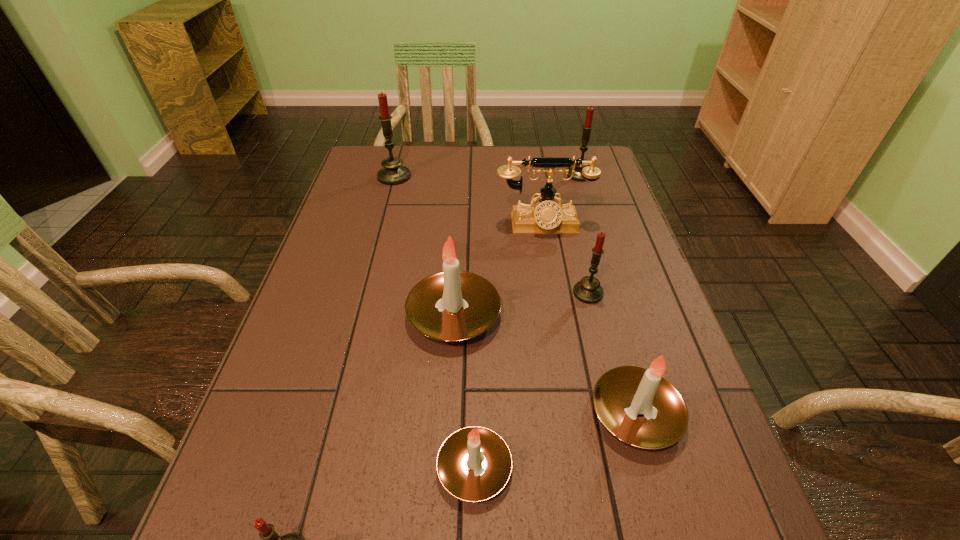
Find the location of a particular element. free space between the biggest red candle and the third smallest red candle is located at coordinates (487, 176).

Find the location of a particular element. Image resolution: width=960 pixels, height=540 pixels. vacant space that's between the third farthest red candle and the rightmost white candle is located at coordinates (612, 353).

Locate which object is the seventh closest to the second biggest red candle. Please provide its 2D coordinates. Your answer should be formatted as a tuple, i.e. [(x, y)], where the tuple contains the x and y coordinates of a point satisfying the conditions above.

[(270, 537)]

This screenshot has height=540, width=960. I want to click on object identified as the seventh closest to the tallest candle, so click(270, 537).

Locate an element on the screen. The height and width of the screenshot is (540, 960). candle that is the third closest to the farthest white candle is located at coordinates (458, 464).

This screenshot has height=540, width=960. I want to click on candle that is the closest to the rightmost white candle, so click(458, 464).

Point out which red candle is positioned as the third nearest to the nearest object. Please provide its 2D coordinates. Your answer should be formatted as a tuple, i.e. [(x, y)], where the tuple contains the x and y coordinates of a point satisfying the conditions above.

[(587, 127)]

Identify which red candle is the closest to the beige telephone. Please provide its 2D coordinates. Your answer should be formatted as a tuple, i.e. [(x, y)], where the tuple contains the x and y coordinates of a point satisfying the conditions above.

[(588, 290)]

I want to click on white candle that is the third closest one to the third farthest red candle, so (x=458, y=464).

Identify which white candle is the closest to the third biggest red candle. Please provide its 2D coordinates. Your answer should be formatted as a tuple, i.e. [(x, y)], where the tuple contains the x and y coordinates of a point satisfying the conditions above.

[(453, 305)]